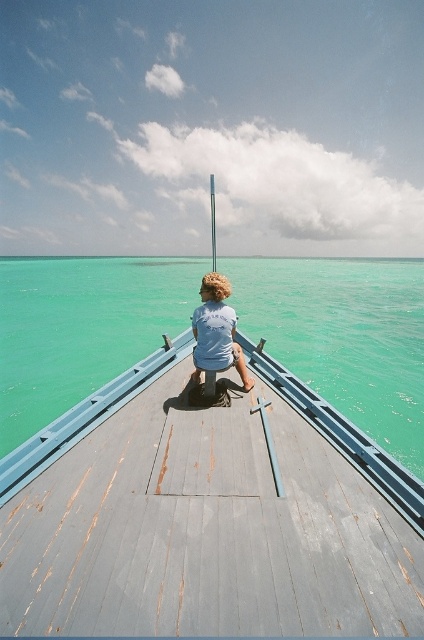
Question: Which object appears farthest from the camera in this image?

Choices:
 (A) rusty wood dock at center
 (B) teal glossy water at center
 (C) light blue fabric shirt at center

Answer: (B)

Question: Is rusty wood dock at center positioned in front of light blue fabric shirt at center?

Choices:
 (A) yes
 (B) no

Answer: (A)

Question: Which point appears farthest from the camera in this image?

Choices:
 (A) (203, 340)
 (B) (114, 496)

Answer: (A)

Question: Is teal glossy water at center thinner than light blue fabric shirt at center?

Choices:
 (A) no
 (B) yes

Answer: (A)

Question: Is rusty wood dock at center positioned at the back of teal glossy water at center?

Choices:
 (A) yes
 (B) no

Answer: (B)

Question: Which object is farther from the camera taking this photo?

Choices:
 (A) light blue fabric shirt at center
 (B) rusty wood dock at center
 (C) teal glossy water at center

Answer: (C)